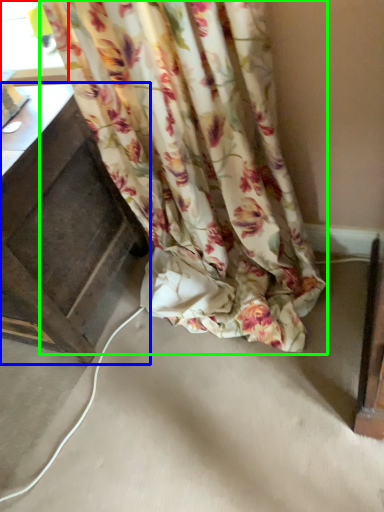
Question: Considering the real-world distances, which object is closest to window (highlighted by a red box)? furniture (highlighted by a blue box) or curtain (highlighted by a green box).

Choices:
 (A) furniture
 (B) curtain

Answer: (A)